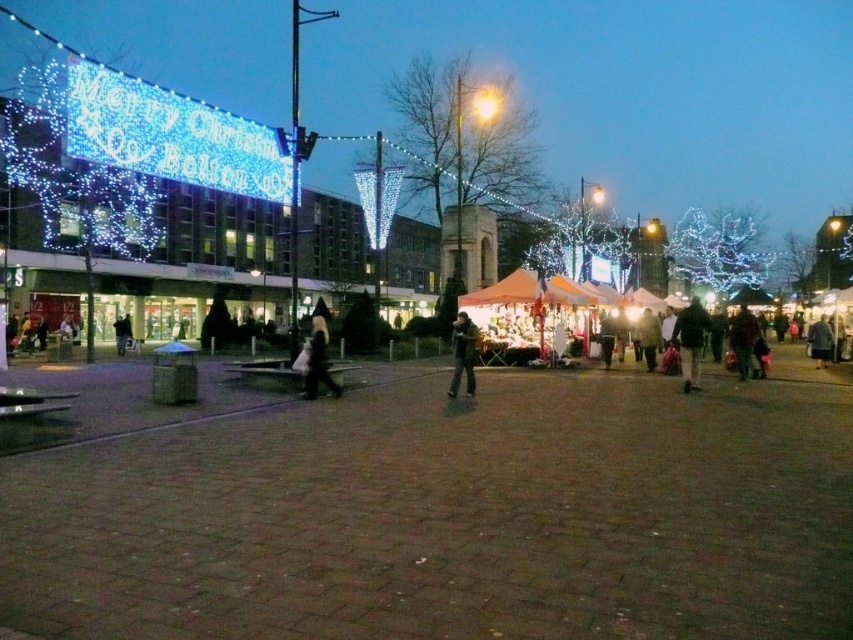
Which is more to the right, dark brown coat at center or dark gray coat at right?

dark gray coat at right

Does dark brown coat at center have a lesser height compared to dark gray coat at right?

Incorrect, dark brown coat at center's height does not fall short of dark gray coat at right's.

Between point (746, 349) and point (816, 353), which one is positioned in front?

Positioned in front is point (746, 349).

You are a GUI agent. You are given a task and a screenshot of the screen. Output one action in this format:
    pyautogui.click(x=<x>, y=<y>)
    Task: Click on the dark brown coat at center
    
    Given the screenshot: What is the action you would take?
    pyautogui.click(x=743, y=339)

Can you confirm if dark gray fabric coat at center is positioned above dark brown coat at center?

No.

Identify the location of dark gray fabric coat at center. This screenshot has height=640, width=853. (318, 358).

Does point (560, 296) lie behind point (648, 362)?

That is True.

Between orange fabric canopy at center and dark brown leather jacket at center, which one is positioned lower?

dark brown leather jacket at center is below.

Which is behind, point (567, 296) or point (646, 365)?

The point (567, 296) is behind.

The width and height of the screenshot is (853, 640). I want to click on orange fabric canopy at center, so click(527, 291).